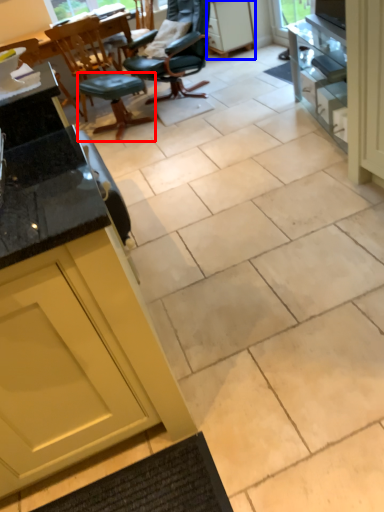
Question: Which object is closer to the camera taking this photo, stool (highlighted by a red box) or cabinetry (highlighted by a blue box)?

Choices:
 (A) stool
 (B) cabinetry

Answer: (A)